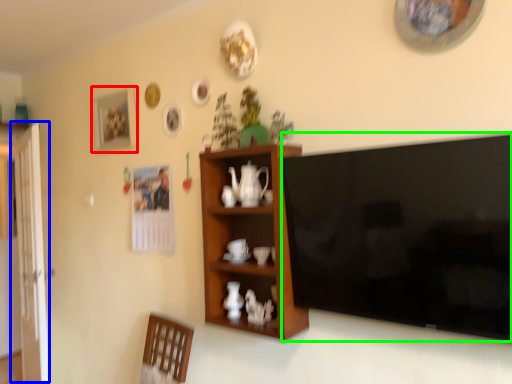
Question: Which object is positioned farthest from picture frame (highlighted by a red box)? Select from glass door (highlighted by a blue box) and television (highlighted by a green box).

Choices:
 (A) glass door
 (B) television

Answer: (B)